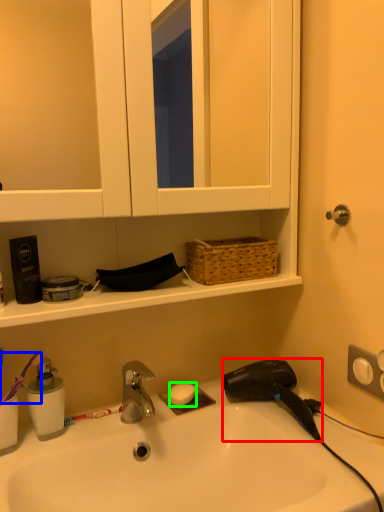
Question: Considering the real-world distances, which object is farthest from hair drier (highlighted by a red box)? brush (highlighted by a blue box) or soap (highlighted by a green box)?

Choices:
 (A) brush
 (B) soap

Answer: (A)